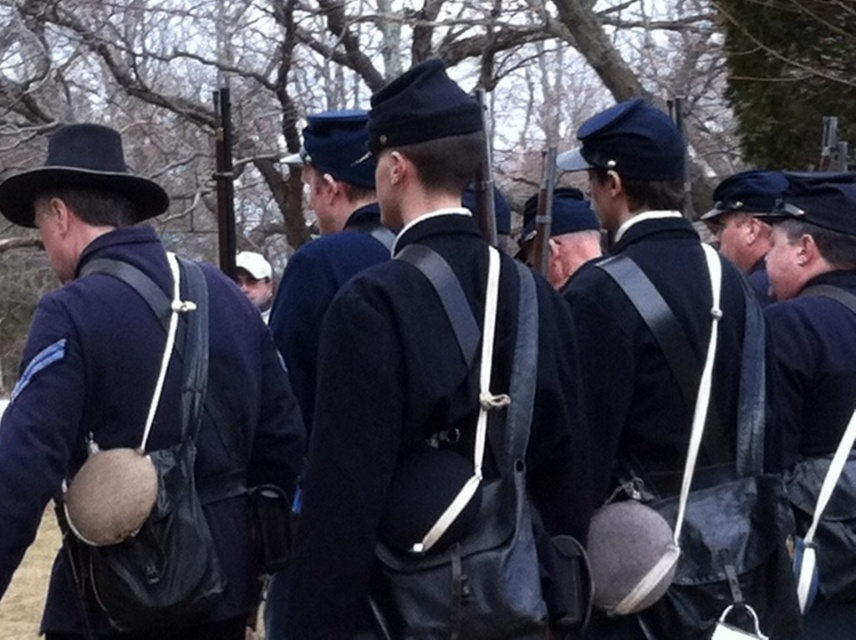
Which is in front, point (595, 422) or point (732, 260)?

Point (595, 422) is more forward.

Which is more to the right, matte black backpack at center or blue wool cap at center?

blue wool cap at center is more to the right.

Who is more distant from viewer, (x=733, y=566) or (x=740, y=202)?

The point (x=740, y=202) is behind.

Locate an element on the screen. matte black backpack at center is located at coordinates (682, 426).

Can you confirm if matte black hat at upper left is bigger than matte black backpack at center?

Indeed, matte black hat at upper left has a larger size compared to matte black backpack at center.

From the picture: Who is more distant from viewer, (57,611) or (648,321)?

Positioned behind is point (57,611).

Find the location of a particular element. matte black hat at upper left is located at coordinates (x=140, y=416).

The height and width of the screenshot is (640, 856). In order to click on matte black hat at upper left in this screenshot , I will do `click(140, 416)`.

Can you confirm if blue wool cap at center is positioned below white fabric cap at center?

Incorrect, blue wool cap at center is not positioned below white fabric cap at center.

Does blue wool cap at center have a lesser width compared to white fabric cap at center?

Indeed, blue wool cap at center has a lesser width compared to white fabric cap at center.

Is point (761, 193) less distant than point (253, 252)?

Yes, point (761, 193) is in front of point (253, 252).

I want to click on blue wool cap at center, so click(745, 221).